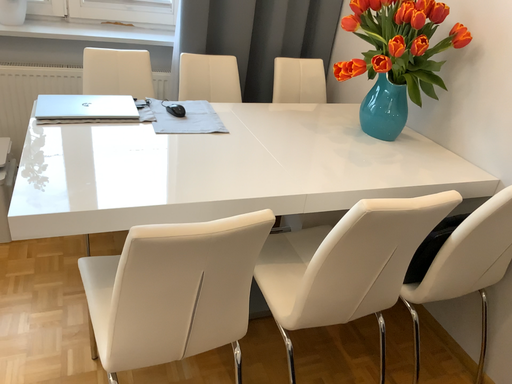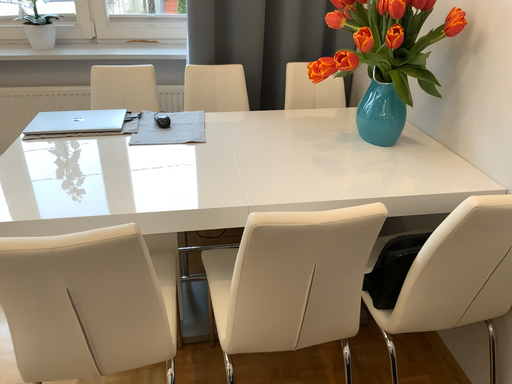
Question: Which way did the camera rotate in the video?

Choices:
 (A) rotated right
 (B) rotated left

Answer: (B)